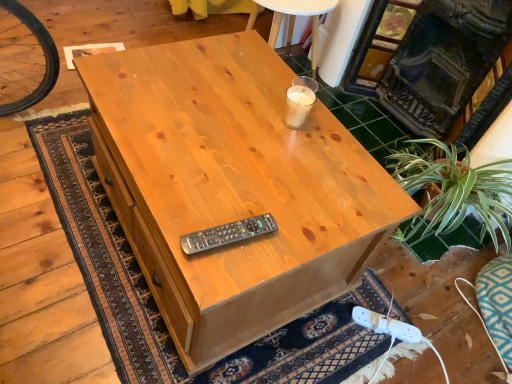
You are a GUI agent. You are given a task and a screenshot of the screen. Output one action in this format:
    pyautogui.click(x=<x>, y=<y>)
    Task: Click on the vacant space situated on the left part of black plastic remote at center
    The image size is (512, 384).
    Given the screenshot: What is the action you would take?
    pyautogui.click(x=177, y=205)